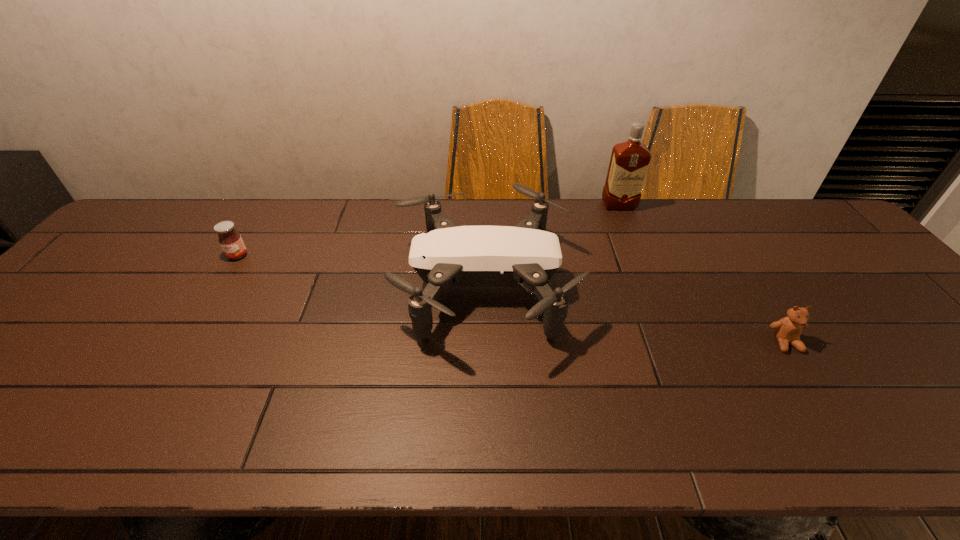
Locate an element on the screen. free location located 0.220m on the face of the rightmost object is located at coordinates (852, 446).

Find the location of `free space located 0.400m on the label side of the leftmost object`. free space located 0.400m on the label side of the leftmost object is located at coordinates (159, 382).

Identify the location of liquor situated at the far edge. (629, 162).

I want to click on drone present at the far edge, so click(x=448, y=255).

Identify the location of free region at the far edge of the desktop. (322, 231).

Where is `vacant space at the left edge of the desktop`? vacant space at the left edge of the desktop is located at coordinates (29, 341).

In the image, there is a desktop. Identify the location of vacant area at the far left corner. (145, 214).

At what (x,y) coordinates should I click in order to perform the action: click on free point at the far right corner. Please return your answer as a coordinate pair (x, y). The height and width of the screenshot is (540, 960). Looking at the image, I should click on (802, 226).

Where is `blank region between the second tallest object and the jam`? The image size is (960, 540). blank region between the second tallest object and the jam is located at coordinates (360, 270).

The height and width of the screenshot is (540, 960). Find the location of `free space between the jam and the teddy bear`. free space between the jam and the teddy bear is located at coordinates (512, 299).